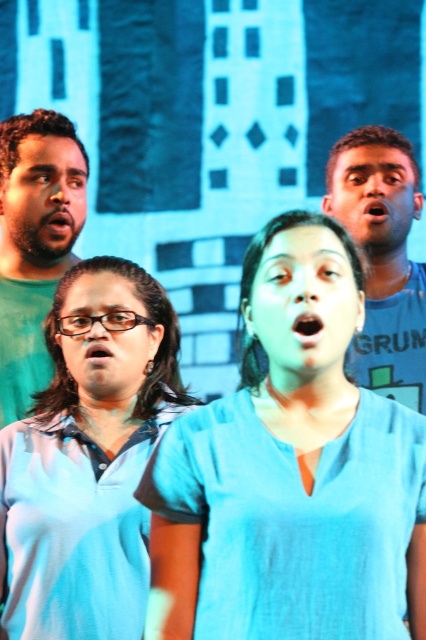
Is blue fabric shirt at center shorter than matte green shirt at left?

Indeed, blue fabric shirt at center has a lesser height compared to matte green shirt at left.

Can you confirm if blue fabric shirt at center is taller than matte green shirt at left?

No.

Is point (14, 552) closer to viewer compared to point (36, 390)?

Yes.

The image size is (426, 640). Find the location of `blue fabric shirt at center`. blue fabric shirt at center is located at coordinates click(88, 460).

This screenshot has width=426, height=640. Describe the element at coordinates (290, 470) in the screenshot. I see `blue cotton shirt at center` at that location.

From the picture: Does blue cotton shirt at center appear under matte green shirt at left?

Correct, blue cotton shirt at center is located below matte green shirt at left.

Locate an element on the screen. Image resolution: width=426 pixels, height=640 pixels. blue cotton shirt at center is located at coordinates (290, 470).

Between point (241, 371) and point (411, 268), which one is positioned behind?

The point (411, 268) is behind.

Can you confirm if blue cotton shirt at center is bigger than blue cotton shirt at upper right?

Correct, blue cotton shirt at center is larger in size than blue cotton shirt at upper right.

Is point (388, 406) in front of point (368, 134)?

Yes, point (388, 406) is in front of point (368, 134).

This screenshot has height=640, width=426. I want to click on blue cotton shirt at center, so click(x=290, y=470).